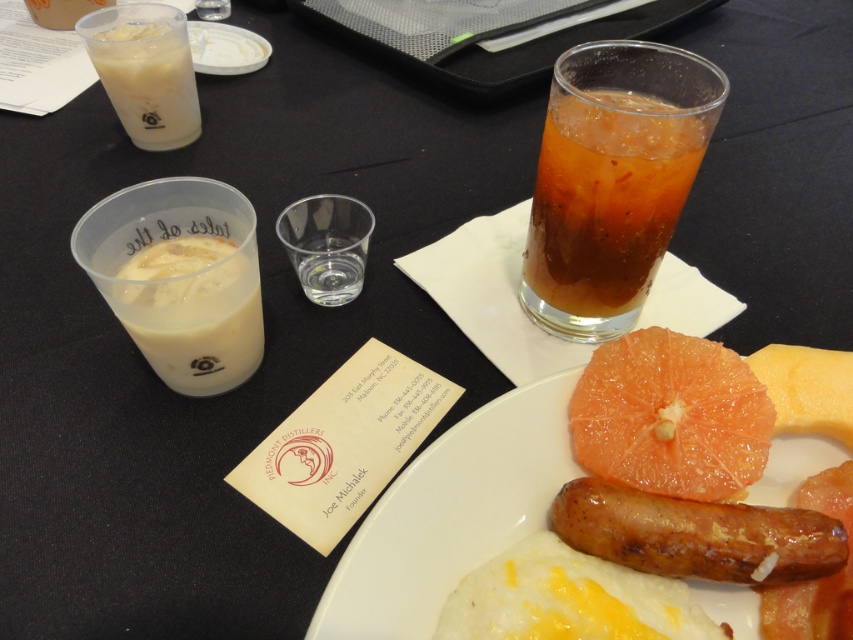
Question: Does milky white liquid at left have a lesser width compared to orange matte grapefruit at center?

Choices:
 (A) no
 (B) yes

Answer: (A)

Question: Is brown crispy sausage at lower right below milky white liquid at left?

Choices:
 (A) no
 (B) yes

Answer: (B)

Question: Which point is closer to the camera?

Choices:
 (A) (403, 541)
 (B) (581, 163)
 (C) (838, 413)

Answer: (A)

Question: Which object appears closest to the camera in this image?

Choices:
 (A) milky white liquid at left
 (B) white opaque cup at upper left

Answer: (A)

Question: Is white opaque cup at upper left bigger than orange matte grapefruit at center?

Choices:
 (A) no
 (B) yes

Answer: (B)

Question: Among these objects, which one is nearest to the camera?

Choices:
 (A) matte white plate at center
 (B) milky white liquid at left

Answer: (A)